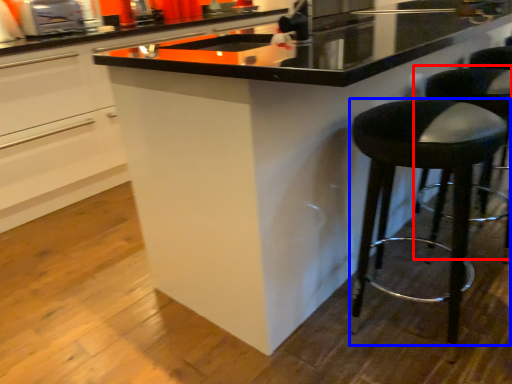
Question: Which object appears farthest to the camera in this image, bar stool (highlighted by a red box) or stool (highlighted by a blue box)?

Choices:
 (A) bar stool
 (B) stool

Answer: (A)